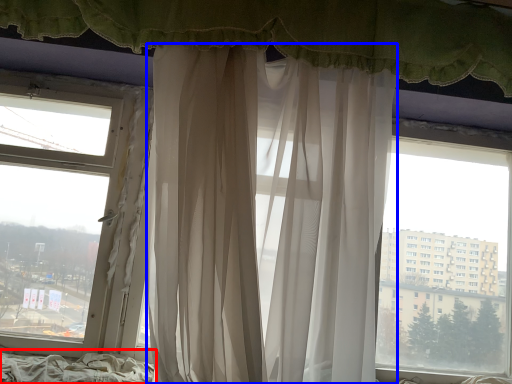
Question: Which point is further to the camera, bed frame (highlighted by a red box) or curtain (highlighted by a blue box)?

Choices:
 (A) bed frame
 (B) curtain

Answer: (A)